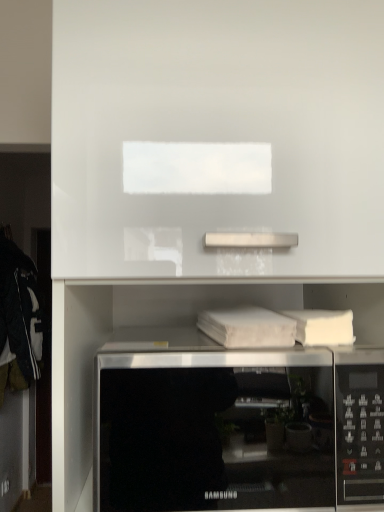
Question: Is the position of white glossy cabinet at upper center more distant than that of satin silver microwave at lower center?

Choices:
 (A) yes
 (B) no

Answer: (B)

Question: Can you confirm if white glossy cabinet at upper center is taller than satin silver microwave at lower center?

Choices:
 (A) yes
 (B) no

Answer: (A)

Question: Is white glossy cabinet at upper center to the left of satin silver microwave at lower center from the viewer's perspective?

Choices:
 (A) yes
 (B) no

Answer: (A)

Question: Is white glossy cabinet at upper center facing towards satin silver microwave at lower center?

Choices:
 (A) no
 (B) yes

Answer: (B)

Question: Is white glossy cabinet at upper center positioned beyond the bounds of satin silver microwave at lower center?

Choices:
 (A) no
 (B) yes

Answer: (B)

Question: From the image's perspective, is white glossy cabinet at upper center on satin silver microwave at lower center?

Choices:
 (A) no
 (B) yes

Answer: (B)

Question: Is satin silver microwave at lower center behind white matte book at center?

Choices:
 (A) no
 (B) yes

Answer: (A)

Question: Can you confirm if satin silver microwave at lower center is shorter than white matte book at center?

Choices:
 (A) no
 (B) yes

Answer: (A)

Question: Does satin silver microwave at lower center have a lesser width compared to white matte book at center?

Choices:
 (A) yes
 (B) no

Answer: (B)

Question: Does satin silver microwave at lower center contain white matte book at center?

Choices:
 (A) yes
 (B) no

Answer: (B)

Question: Is satin silver microwave at lower center located outside white matte book at center?

Choices:
 (A) yes
 (B) no

Answer: (A)

Question: Is satin silver microwave at lower center facing towards white matte book at center?

Choices:
 (A) yes
 (B) no

Answer: (B)

Question: Is satin silver microwave at lower center positioned before white glossy cabinet at upper center?

Choices:
 (A) no
 (B) yes

Answer: (A)